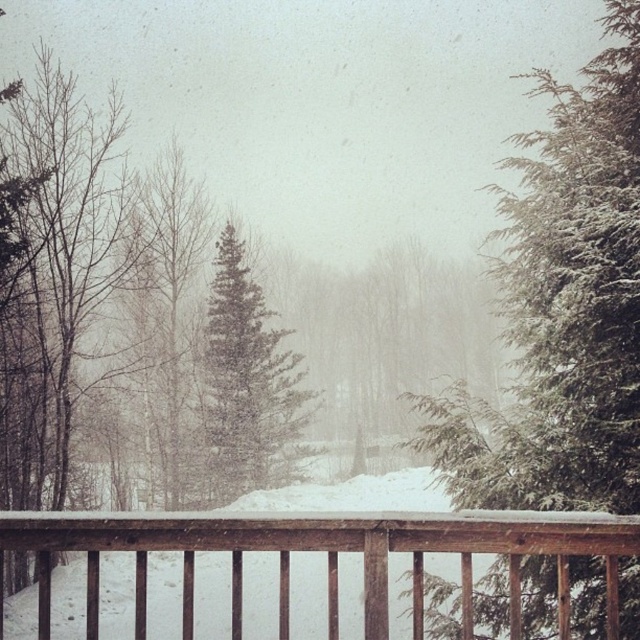
Is the position of brown wooden railing at center less distant than that of green matte evergreen tree at center?

Yes, brown wooden railing at center is closer to the viewer.

Who is more distant from viewer, [177,536] or [241,348]?

Positioned behind is point [241,348].

The width and height of the screenshot is (640, 640). Find the location of `brown wooden railing at center`. brown wooden railing at center is located at coordinates (326, 556).

Can you confirm if green textured evergreen tree at right is shorter than green matte evergreen tree at center?

No, green textured evergreen tree at right is not shorter than green matte evergreen tree at center.

Does green textured evergreen tree at right appear over green matte evergreen tree at center?

Correct, green textured evergreen tree at right is located above green matte evergreen tree at center.

What do you see at coordinates (564, 307) in the screenshot? I see `green textured evergreen tree at right` at bounding box center [564, 307].

The image size is (640, 640). What are the coordinates of `green textured evergreen tree at right` in the screenshot? It's located at (564, 307).

Is green textured evergreen tree at right below brown wooden railing at center?

Actually, green textured evergreen tree at right is above brown wooden railing at center.

From the picture: Does green textured evergreen tree at right have a smaller size compared to brown wooden railing at center?

No.

Does point (589, 448) lie behind point (193, 579)?

Yes, point (589, 448) is behind point (193, 579).

Where is `green textured evergreen tree at right`? This screenshot has width=640, height=640. green textured evergreen tree at right is located at coordinates (564, 307).